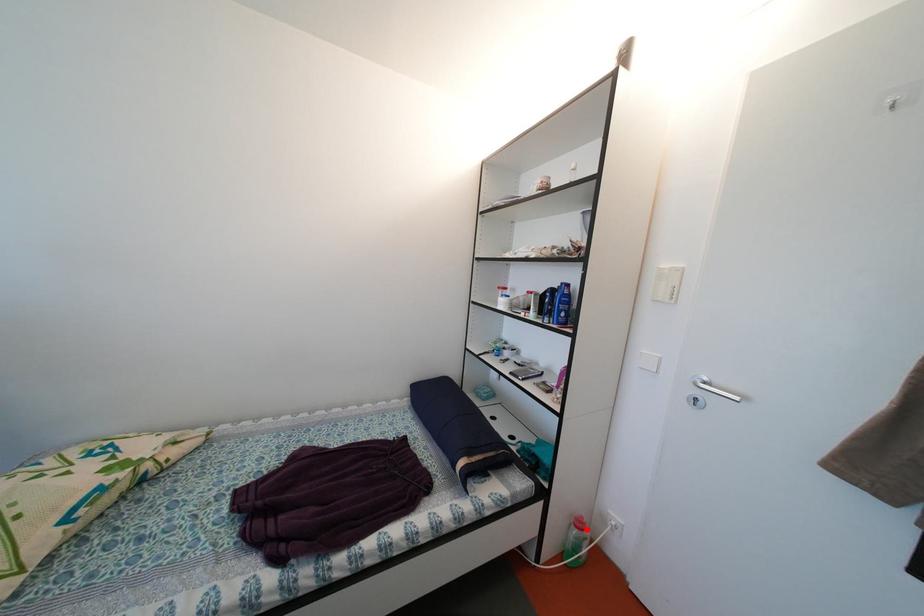
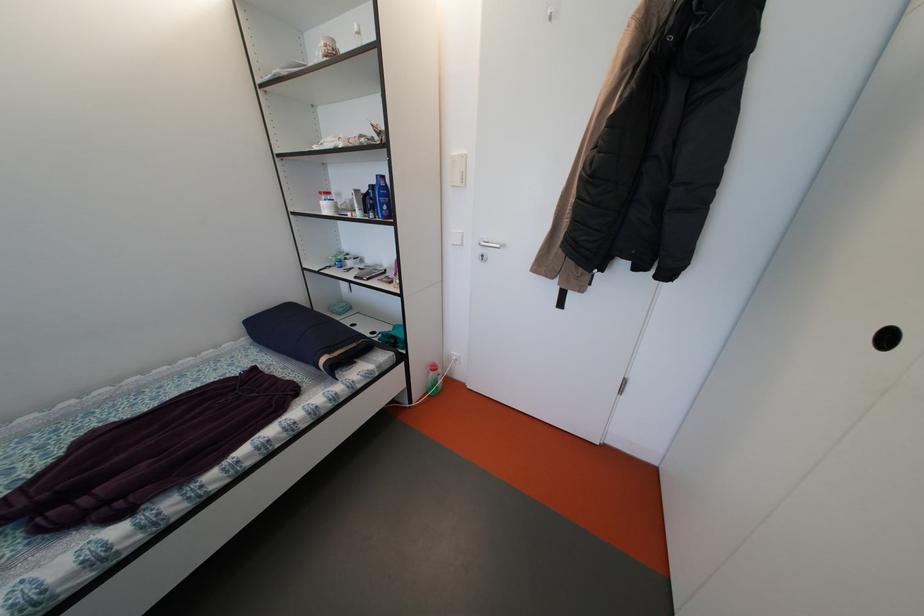
Where in the second image is the point corresponding to the highlighted location from the first image?

(441, 373)